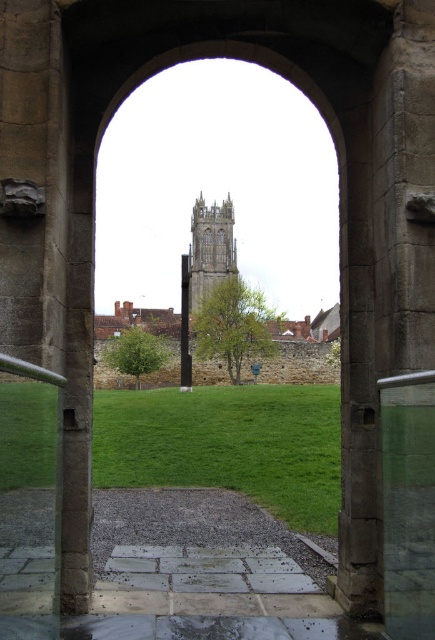
In the scene shown: You are standing outside the arched gateway and want to walk towards the stone tower at center. Which direction should you walk relative to the green grass at center?

The green grass at center is below the stone tower at center, so you should walk forward towards the stone tower at center as it is positioned above the green grass at center in the scene.

You are standing outside the arched stone gateway and want to walk towards the green grass at center. Which direction should you walk relative to the stone gothic tower at center?

The green grass at center is to the right of the stone gothic tower at center, so you should walk to the right side of the stone gothic tower at center to reach the green grass at center.